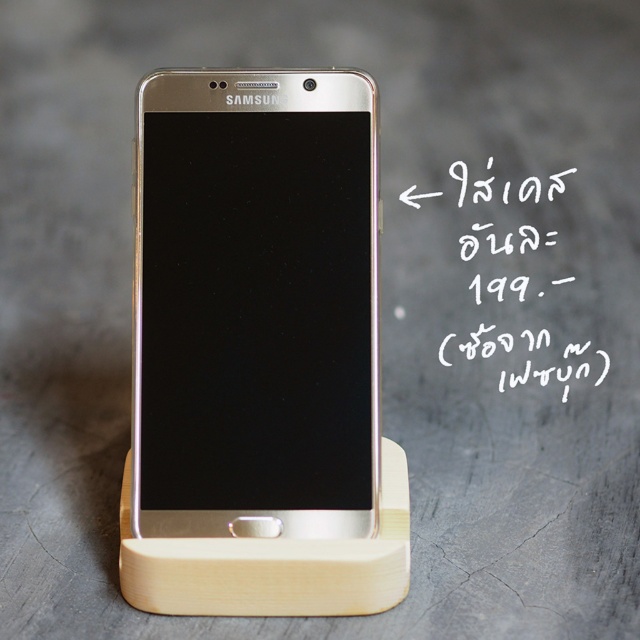
You are setting up a presentation and need to position the silver metallic smartphone at center and the white handwritten text at upper center in a way that they are both visible to the audience. Based on their current positions, which object should be moved to the right to ensure both are visible without overlapping?

The silver metallic smartphone at center should be moved to the right since it is currently to the left of the white handwritten text at upper center, so shifting it right would prevent overlap and ensure both are visible.

You are setting up a display for a product launch event. You have a silver metallic smartphone at center and a white handwritten text at upper center. Which item takes up more space in the display?

The white handwritten text at upper center takes up more space than the silver metallic smartphone at center.